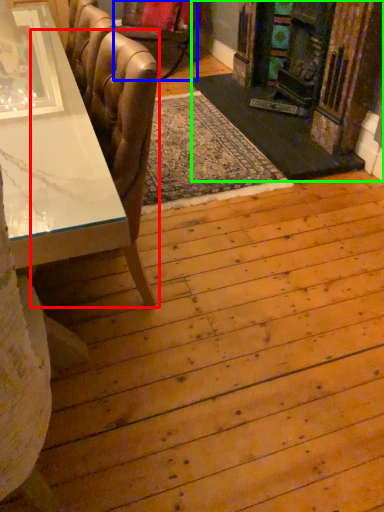
Question: Which object is the closest to the chair (highlighted by a red box)? Choose among these: chair (highlighted by a blue box) or fireplace (highlighted by a green box).

Choices:
 (A) chair
 (B) fireplace

Answer: (B)